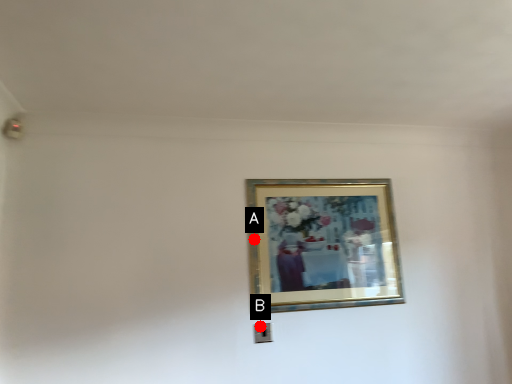
Question: Two points are circled on the image, labeled by A and B beside each circle. Among these points, which one is nearest to the camera?

Choices:
 (A) A is closer
 (B) B is closer

Answer: (B)